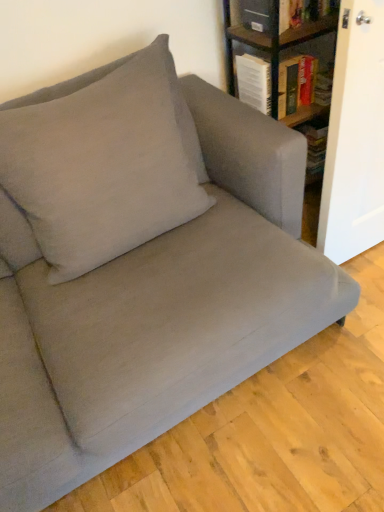
Question: Can you confirm if hardcover book at upper right is smaller than suede-like beige pillow at upper left?

Choices:
 (A) yes
 (B) no

Answer: (A)

Question: Would you say hardcover book at upper right contains suede-like beige pillow at upper left?

Choices:
 (A) no
 (B) yes

Answer: (A)

Question: From a real-world perspective, is hardcover book at upper right positioned over suede-like beige pillow at upper left based on gravity?

Choices:
 (A) yes
 (B) no

Answer: (B)

Question: Is hardcover book at upper right bigger than suede-like beige pillow at upper left?

Choices:
 (A) no
 (B) yes

Answer: (A)

Question: Considering the relative sizes of hardcover book at upper right and suede-like beige pillow at upper left in the image provided, is hardcover book at upper right thinner than suede-like beige pillow at upper left?

Choices:
 (A) no
 (B) yes

Answer: (B)

Question: From a real-world perspective, is hardcover book at upper right located beneath suede-like beige pillow at upper left?

Choices:
 (A) no
 (B) yes

Answer: (B)

Question: Does hardcover book at upper right contain wooden bookshelf at upper right?

Choices:
 (A) no
 (B) yes

Answer: (A)

Question: Is hardcover book at upper right facing towards wooden bookshelf at upper right?

Choices:
 (A) no
 (B) yes

Answer: (B)

Question: From the image's perspective, is hardcover book at upper right below wooden bookshelf at upper right?

Choices:
 (A) yes
 (B) no

Answer: (A)

Question: Considering the relative sizes of hardcover book at upper right and wooden bookshelf at upper right in the image provided, is hardcover book at upper right shorter than wooden bookshelf at upper right?

Choices:
 (A) no
 (B) yes

Answer: (B)

Question: From a real-world perspective, is hardcover book at upper right on top of wooden bookshelf at upper right?

Choices:
 (A) yes
 (B) no

Answer: (B)

Question: Is hardcover book at upper right facing away from wooden bookshelf at upper right?

Choices:
 (A) yes
 (B) no

Answer: (A)

Question: Is wooden bookshelf at upper right thinner than suede-like beige pillow at upper left?

Choices:
 (A) no
 (B) yes

Answer: (A)